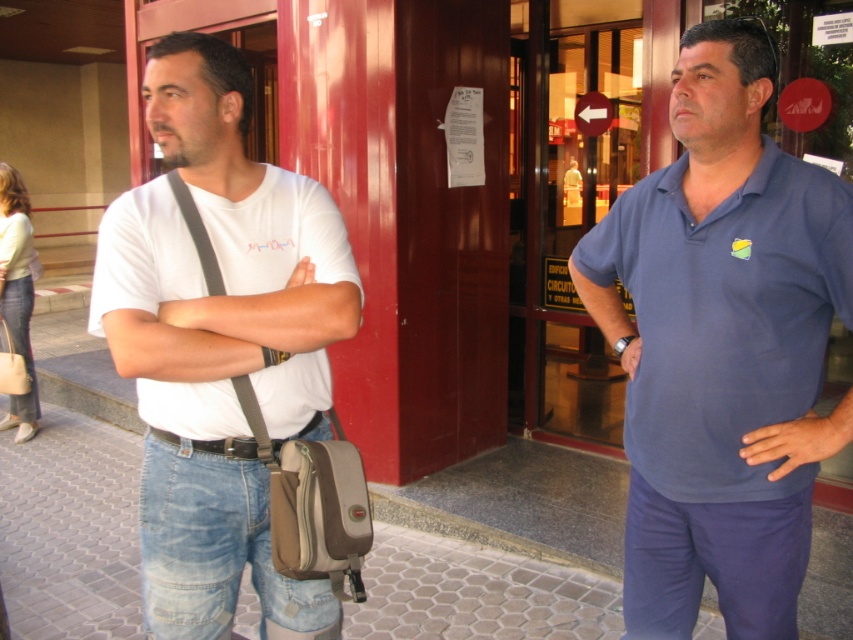
You are a tailor measuring a mannequin wearing the blue cotton polo shirt at center and the black leather belt at center. The mannequin needs to have a minimum of 30 inches between the shirt and belt to allow for proper movement. Can the current placement accommodate this requirement?

The blue cotton polo shirt at center is 33.58 inches from the black leather belt at center, which exceeds the required 30 inches, so the placement accommodates the movement requirement.

You are standing in an urban area near a building with red doors and glass windows. You need to reach a specific point marked at coordinates point (741, 20). If you are currently 10 feet away from the building, can you estimate whether you need to move closer or farther away to reach that point?

The distance of point (741, 20) from viewer is 5.51 feet. Since you are currently 10 feet away from the building, you need to move closer to reach the point as 5.51 feet is less than 10 feet.